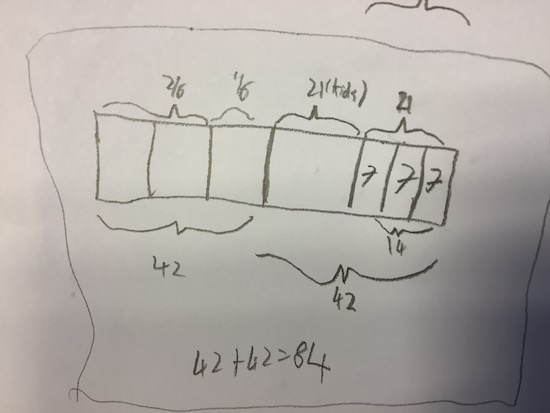
Identify the location of empty box. (125, 155), (176, 163), (236, 165), (297, 169).